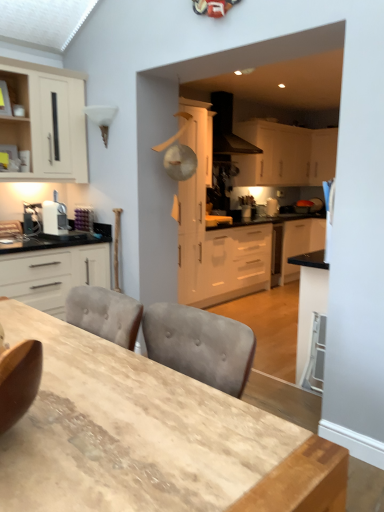
Question: Does white matte cabinet at upper center, placed as the 2th cabinetry when sorted from back to front, come behind white matte cabinet at center, the third cabinetry viewed from the front?

Choices:
 (A) no
 (B) yes

Answer: (B)

Question: From a real-world perspective, is white matte cabinet at upper center, marked as the 2th cabinetry in a right-to-left arrangement, over white matte cabinet at center, acting as the third cabinetry starting from the back?

Choices:
 (A) yes
 (B) no

Answer: (A)

Question: From the image's perspective, is white matte cabinet at upper center, marked as the 2th cabinetry in a right-to-left arrangement, below white matte cabinet at center, arranged as the third cabinetry when viewed from the right?

Choices:
 (A) yes
 (B) no

Answer: (B)

Question: Is white matte cabinet at upper center, positioned as the fourth cabinetry in front-to-back order, wider than white matte cabinet at center, the third cabinetry viewed from the front?

Choices:
 (A) yes
 (B) no

Answer: (B)

Question: Considering the relative sizes of white matte cabinet at upper center, which ranks as the fourth cabinetry in left-to-right order, and white matte cabinet at center, which is counted as the third cabinetry, starting from the left, in the image provided, is white matte cabinet at upper center, which ranks as the fourth cabinetry in left-to-right order, taller than white matte cabinet at center, which is counted as the third cabinetry, starting from the left,?

Choices:
 (A) yes
 (B) no

Answer: (B)

Question: Does white matte cabinet at upper center, positioned as the fourth cabinetry in front-to-back order, have a lesser height compared to white matte cabinet at center, acting as the third cabinetry starting from the back?

Choices:
 (A) yes
 (B) no

Answer: (A)

Question: Is wooden table at center positioned before black matte range hood at upper center?

Choices:
 (A) yes
 (B) no

Answer: (A)

Question: Does wooden table at center lie behind black matte range hood at upper center?

Choices:
 (A) yes
 (B) no

Answer: (B)

Question: Could black matte range hood at upper center be considered to be inside wooden table at center?

Choices:
 (A) no
 (B) yes

Answer: (A)

Question: From a real-world perspective, is wooden table at center physically below black matte range hood at upper center?

Choices:
 (A) no
 (B) yes

Answer: (B)

Question: Is wooden table at center aimed at black matte range hood at upper center?

Choices:
 (A) no
 (B) yes

Answer: (A)

Question: Is there a large distance between wooden table at center and black matte range hood at upper center?

Choices:
 (A) no
 (B) yes

Answer: (B)

Question: Would you consider black matte range hood at upper center to be distant from wooden table at center?

Choices:
 (A) no
 (B) yes

Answer: (B)